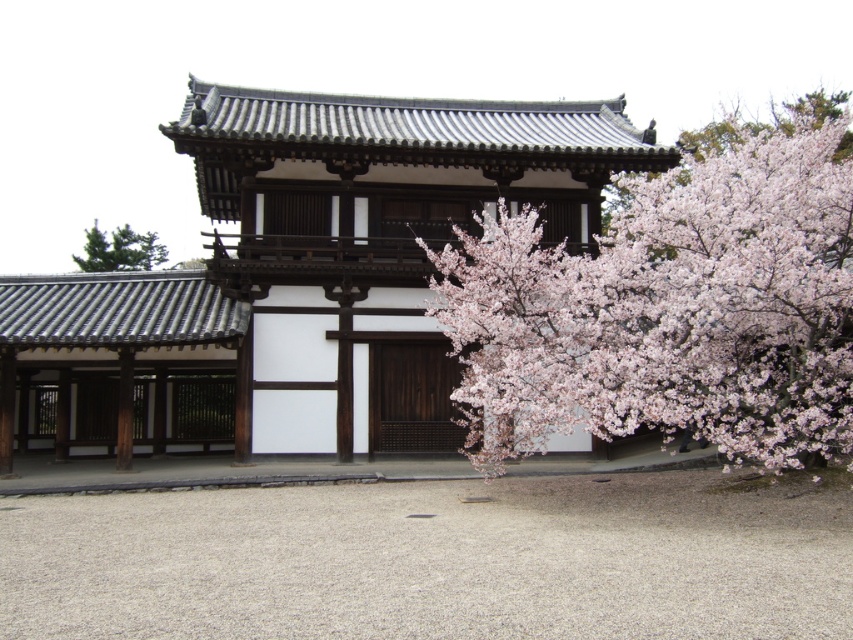
Is pink blossoms at right behind green textured tree at upper left?

No.

Which is behind, point (502, 420) or point (128, 248)?

The point (128, 248) is behind.

Where is `pink blossoms at right`? This screenshot has height=640, width=853. pink blossoms at right is located at coordinates click(669, 308).

Does pink blossoms at right appear on the left side of matte gray wood at left?

No, pink blossoms at right is not to the left of matte gray wood at left.

Does pink blossoms at right have a lesser height compared to matte gray wood at left?

Incorrect, pink blossoms at right's height does not fall short of matte gray wood at left's.

Is point (848, 449) farther from viewer compared to point (38, 275)?

No, (848, 449) is in front of (38, 275).

Where is `pink blossoms at right`? This screenshot has width=853, height=640. pink blossoms at right is located at coordinates (669, 308).

Does white wood building at center come behind green textured tree at upper left?

That is False.

Which is above, white wood building at center or green textured tree at upper left?

green textured tree at upper left

Between point (570, 184) and point (129, 248), which one is positioned in front?

Point (570, 184) is in front.

The height and width of the screenshot is (640, 853). I want to click on white wood building at center, so click(376, 236).